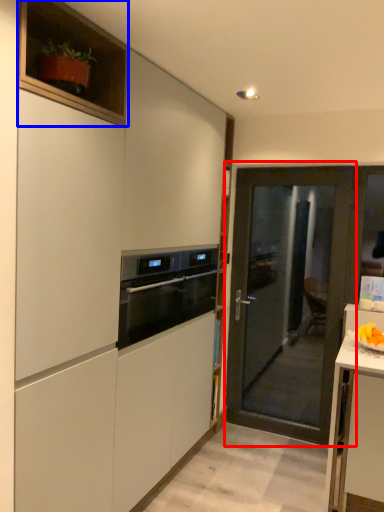
Question: Which of the following is the farthest to the observer, door (highlighted by a red box) or cabinetry (highlighted by a blue box)?

Choices:
 (A) door
 (B) cabinetry

Answer: (A)